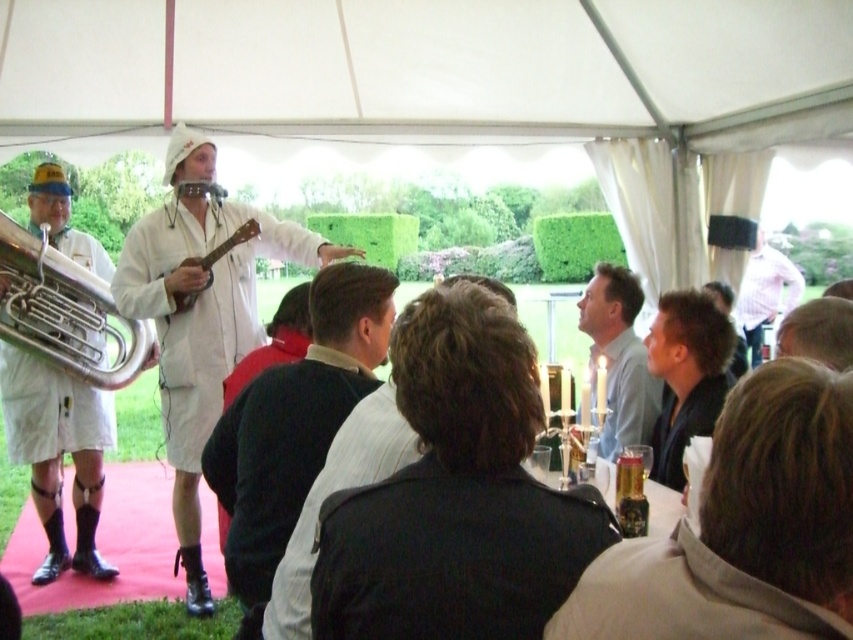
You are a photographer at the event and need to capture both the white matte coat at center and the brass polished trumpet at left in a single shot. Which object should you focus on first to ensure both are in frame?

The white matte coat at center has a greater height compared to the brass polished trumpet at left. To ensure both are in frame, focus on the taller object first, which is the white matte coat at center, then adjust the camera angle to include the brass polished trumpet at left.

You are a photographer at the event and need to capture both the white matte coat at center and the brass polished trumpet at left in a single frame. Which object should you focus on first to ensure both are in the frame without moving the camera?

You should focus on the white matte coat at center first because it is larger in size compared to the brass polished trumpet at left, ensuring it fits within the frame while the smaller trumpet remains visible.